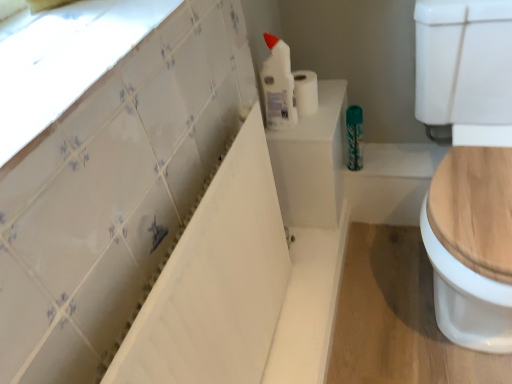
The image size is (512, 384). What are the coordinates of `white glossy tile at upper left` in the screenshot? It's located at (63, 59).

Image resolution: width=512 pixels, height=384 pixels. I want to click on white glossy bathtub at upper left, so click(x=214, y=280).

Looking at this image, in order to face white glossy bottle at upper center, should I rotate leftwards or rightwards?

A 3.089 degree turn to the right will do.

Identify the location of white glossy tile at upper left. Image resolution: width=512 pixels, height=384 pixels. (63, 59).

Looking at this image, is white glossy bottle at upper center spatially inside white glossy tile at upper left, or outside of it?

white glossy bottle at upper center is not enclosed by white glossy tile at upper left.

Where is `window sill above the white glossy bottle at upper center (from a real-world perspective)`? The image size is (512, 384). window sill above the white glossy bottle at upper center (from a real-world perspective) is located at coordinates (63, 59).

Is white glossy bottle at upper center wider or thinner than white glossy tile at upper left?

white glossy bottle at upper center is thinner than white glossy tile at upper left.

From a real-world perspective, between white glossy bottle at upper center and white glossy tile at upper left, who is vertically lower?

white glossy bottle at upper center, from a real-world perspective.

Looking at this image, from the image's perspective, is white glossy bottle at upper center located above or below teal metallic can at center?

Based on their image positions, white glossy bottle at upper center is located above teal metallic can at center.

Does point (272, 68) come in front of point (361, 129)?

Yes, it is.

From a real-world perspective, which object stands above the other?

From a 3D spatial view, white glossy bottle at upper center is above.

Does white glossy bottle at upper center appear on the left side of teal metallic can at center?

Yes.

Is white glossy tile at upper left not within teal metallic can at center?

Absolutely, white glossy tile at upper left is external to teal metallic can at center.

From a real-world perspective, is white glossy tile at upper left physically above teal metallic can at center?

Indeed, from a real-world perspective, white glossy tile at upper left stands above teal metallic can at center.

Relative to teal metallic can at center, is white glossy tile at upper left in front or behind?

white glossy tile at upper left is positioned closer to the viewer than teal metallic can at center.

Who is taller, white glossy tile at upper left or teal metallic can at center?

Standing taller between the two is teal metallic can at center.

Does white glossy bathtub at upper left have a smaller size compared to teal metallic can at center?

Actually, white glossy bathtub at upper left might be larger than teal metallic can at center.

Which object is further away from the camera taking this photo, white glossy bathtub at upper left or teal metallic can at center?

teal metallic can at center is behind.

Is teal metallic can at center at the back of white glossy bathtub at upper left?

white glossy bathtub at upper left does not have its back to teal metallic can at center.

Considering the sizes of objects white glossy bathtub at upper left and teal metallic can at center in the image provided, who is wider, white glossy bathtub at upper left or teal metallic can at center?

Wider between the two is white glossy bathtub at upper left.

Between white glossy tile at upper left and white glossy bathtub at upper left, which one is positioned in front?

Positioned in front is white glossy tile at upper left.

From a real-world perspective, is white glossy tile at upper left under white glossy bathtub at upper left?

No, from a real-world perspective, white glossy tile at upper left is not under white glossy bathtub at upper left.

Which is correct: white glossy tile at upper left is inside white glossy bathtub at upper left, or outside of it?

white glossy tile at upper left is spatially situated outside white glossy bathtub at upper left.

Considering the relative sizes of white glossy tile at upper left and white glossy bathtub at upper left in the image provided, is white glossy tile at upper left shorter than white glossy bathtub at upper left?

Correct, white glossy tile at upper left is not as tall as white glossy bathtub at upper left.

Between point (170, 9) and point (265, 90), which one is positioned behind?

Point (265, 90)

Which of these two, white glossy tile at upper left or white glossy bottle at upper center, is wider?

With larger width is white glossy tile at upper left.

Based on the photo, is white glossy tile at upper left taller or shorter than white glossy bottle at upper center?

white glossy tile at upper left is shorter than white glossy bottle at upper center.

Is white matte toilet paper at upper center oriented away from white glossy tile at upper left?

white matte toilet paper at upper center is not turned away from white glossy tile at upper left.

Can you tell me how much white matte toilet paper at upper center and white glossy tile at upper left differ in facing direction?

The facing directions of white matte toilet paper at upper center and white glossy tile at upper left are 0.15 degrees apart.

Is white matte toilet paper at upper center shorter than white glossy tile at upper left?

In fact, white matte toilet paper at upper center may be taller than white glossy tile at upper left.

This screenshot has width=512, height=384. Find the location of `window sill positioned vertically above the white glossy bottle at upper center (from a real-world perspective)`. window sill positioned vertically above the white glossy bottle at upper center (from a real-world perspective) is located at coordinates (63, 59).

Where is `toiletry that is under the white glossy bottle at upper center (from a real-world perspective)`? toiletry that is under the white glossy bottle at upper center (from a real-world perspective) is located at coordinates (354, 137).

Based on their spatial positions, is white glossy bottle at upper center or white glossy tile at upper left further from white matte toilet paper at upper center?

Among the two, white glossy tile at upper left is located further to white matte toilet paper at upper center.

Which object lies nearer to the anchor point white glossy bathtub at upper left, teal metallic can at center or white matte toilet paper at upper center?

The object closer to white glossy bathtub at upper left is white matte toilet paper at upper center.

Looking at the image, which one is located closer to white glossy tile at upper left, white matte toilet paper at upper center or white glossy bottle at upper center?

Among the two, white glossy bottle at upper center is located nearer to white glossy tile at upper left.

From the image, which object appears to be nearer to white glossy tile at upper left, white matte toilet paper at upper center or teal metallic can at center?

white matte toilet paper at upper center is positioned closer to the anchor white glossy tile at upper left.

Based on their spatial positions, is white glossy bottle at upper center or white matte toilet paper at upper center closer to white glossy tile at upper left?

white glossy bottle at upper center is positioned closer to the anchor white glossy tile at upper left.

Considering their positions, is white glossy bathtub at upper left positioned closer to white glossy bottle at upper center than white glossy tile at upper left?

Among the two, white glossy bathtub at upper left is located nearer to white glossy bottle at upper center.

From the picture: Which object lies nearer to the anchor point white glossy bathtub at upper left, white glossy bottle at upper center or white glossy tile at upper left?

Based on the image, white glossy tile at upper left appears to be nearer to white glossy bathtub at upper left.

When comparing their distances from teal metallic can at center, does white glossy tile at upper left or white glossy bottle at upper center seem further?

white glossy tile at upper left is positioned further to the anchor teal metallic can at center.

This screenshot has width=512, height=384. I want to click on bath located between white glossy tile at upper left and teal metallic can at center in the depth direction, so click(214, 280).

Identify the location of bath between white glossy tile at upper left and white glossy bottle at upper center in the front-back direction. The width and height of the screenshot is (512, 384). [x=214, y=280].

Where is `cleaning product located between white glossy bathtub at upper left and teal metallic can at center in the depth direction`? cleaning product located between white glossy bathtub at upper left and teal metallic can at center in the depth direction is located at coordinates [x=278, y=85].

What are the coordinates of `toilet paper between white glossy bottle at upper center and teal metallic can at center` in the screenshot? It's located at [305, 92].